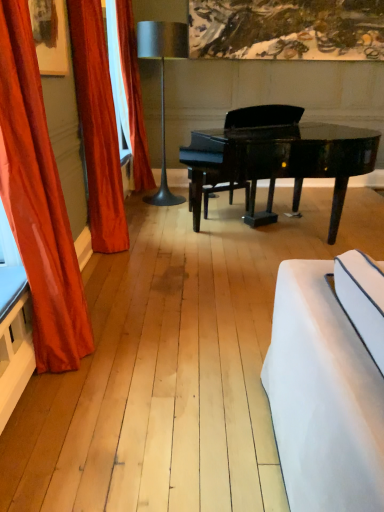
This screenshot has width=384, height=512. Identify the location of free space to the right of velvet orange curtain at left, the second curtain when ordered from back to front. (152, 246).